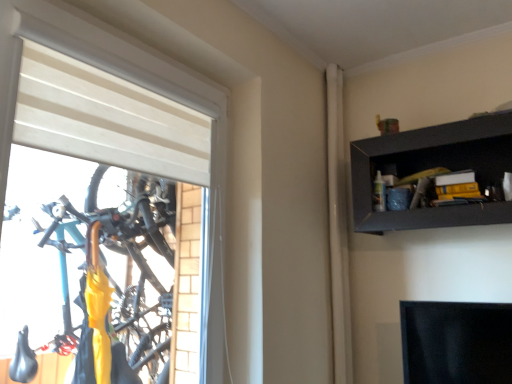
Question: Is black matte shelf at upper right next to white matte window at left?

Choices:
 (A) no
 (B) yes

Answer: (A)

Question: Considering the relative sizes of black matte shelf at upper right and white matte window at left in the image provided, is black matte shelf at upper right bigger than white matte window at left?

Choices:
 (A) yes
 (B) no

Answer: (B)

Question: From a real-world perspective, does black matte shelf at upper right stand above white matte window at left?

Choices:
 (A) no
 (B) yes

Answer: (B)

Question: Is the position of black matte shelf at upper right more distant than that of white matte window at left?

Choices:
 (A) no
 (B) yes

Answer: (B)

Question: Does black matte shelf at upper right contain white matte window at left?

Choices:
 (A) no
 (B) yes

Answer: (A)

Question: Based on their positions, is white matte curtain at upper right located to the left or right of white matte window at left?

Choices:
 (A) left
 (B) right

Answer: (B)

Question: Do you think white matte curtain at upper right is within white matte window at left, or outside of it?

Choices:
 (A) inside
 (B) outside

Answer: (B)

Question: Relative to white matte window at left, is white matte curtain at upper right in front or behind?

Choices:
 (A) front
 (B) behind

Answer: (B)

Question: From a real-world perspective, is white matte curtain at upper right above or below white matte window at left?

Choices:
 (A) below
 (B) above

Answer: (B)

Question: In the image, is white matte window at left positioned in front of or behind white matte curtain at upper right?

Choices:
 (A) behind
 (B) front

Answer: (B)

Question: In terms of height, does white matte window at left look taller or shorter compared to white matte curtain at upper right?

Choices:
 (A) tall
 (B) short

Answer: (B)

Question: Is white matte window at left bigger or smaller than white matte curtain at upper right?

Choices:
 (A) small
 (B) big

Answer: (B)

Question: Is point click(152, 142) positioned closer to the camera than point click(343, 155)?

Choices:
 (A) farther
 (B) closer

Answer: (B)

Question: From the image's perspective, is white matte curtain at upper right positioned above or below black matte shelf at upper right?

Choices:
 (A) above
 (B) below

Answer: (B)

Question: Considering the positions of white matte curtain at upper right and black matte shelf at upper right in the image, is white matte curtain at upper right bigger or smaller than black matte shelf at upper right?

Choices:
 (A) small
 (B) big

Answer: (A)